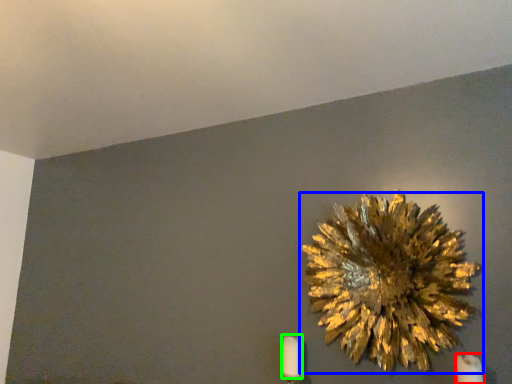
Question: Considering the real-world distances, which object is farthest from candle (highlighted by a red box)? flower (highlighted by a blue box) or candle (highlighted by a green box)?

Choices:
 (A) flower
 (B) candle

Answer: (B)